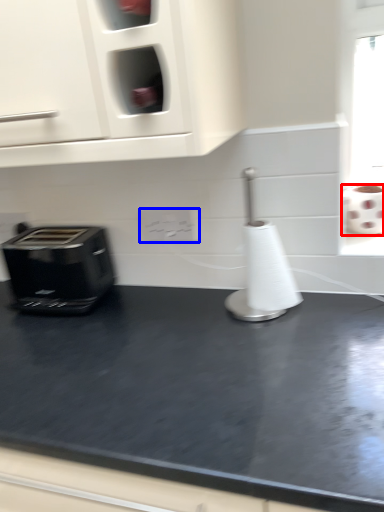
Question: Which object appears closest to the camera in this image, toilet paper (highlighted by a red box) or electric outlet (highlighted by a blue box)?

Choices:
 (A) toilet paper
 (B) electric outlet

Answer: (A)